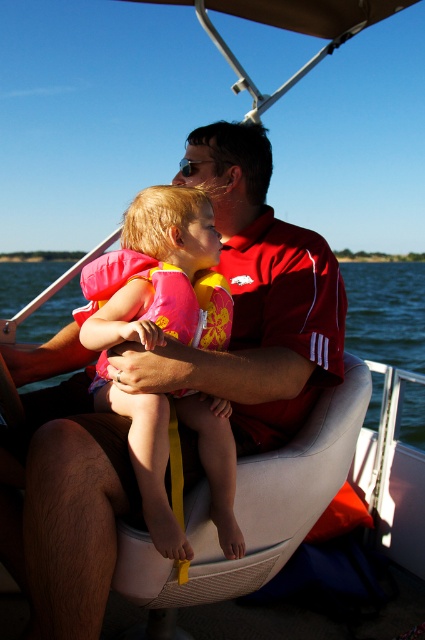
Question: Which of the following is the farthest from the observer?

Choices:
 (A) (127, 252)
 (B) (164, 198)
 (C) (385, 298)

Answer: (C)

Question: Can you confirm if pink life vest at center is positioned below pink fabric life jacket at center?

Choices:
 (A) yes
 (B) no

Answer: (A)

Question: Which point is farther to the camera?

Choices:
 (A) (50, 308)
 (B) (227, 420)
 (C) (215, 284)

Answer: (A)

Question: In this image, where is pink life vest at center located relative to pink fabric life jacket at center?

Choices:
 (A) below
 (B) above

Answer: (A)

Question: In this image, where is blue water at center located relative to pink fabric life jacket at center?

Choices:
 (A) above
 (B) below

Answer: (A)

Question: Which object appears closest to the camera in this image?

Choices:
 (A) pink fabric life jacket at center
 (B) blue water at center

Answer: (A)